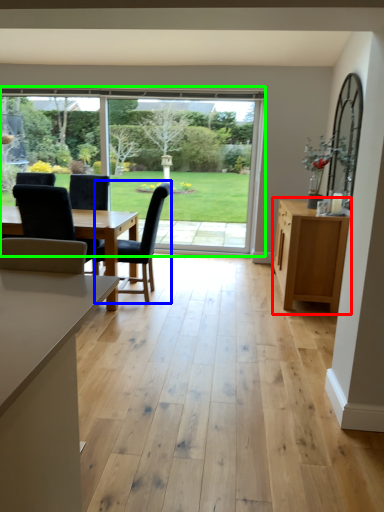
Question: Based on their relative distances, which object is nearer to cabinetry (highlighted by a red box)? Choose from chair (highlighted by a blue box) and window (highlighted by a green box).

Choices:
 (A) chair
 (B) window

Answer: (A)